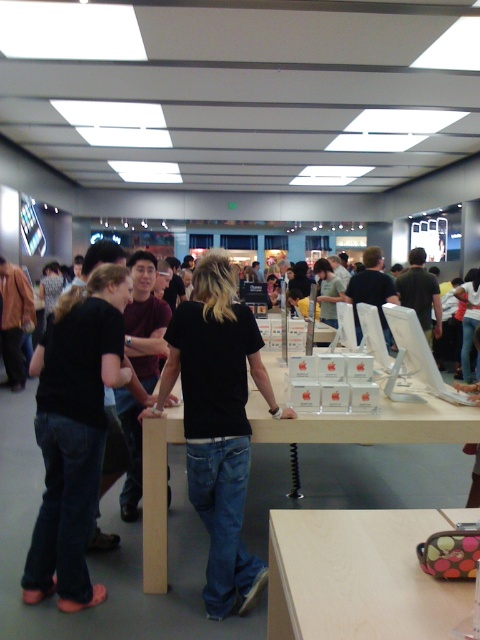
Does wooden table at lower right lie behind light wood table at center?

That is False.

From the picture: Who is more distant from viewer, (374, 522) or (463, 419)?

The point (463, 419) is behind.

At what (x,y) coordinates should I click in order to perform the action: click on wooden table at lower right. Please return your answer as a coordinate pair (x, y). Image resolution: width=480 pixels, height=640 pixels. Looking at the image, I should click on (358, 577).

Find the location of `black matte shirt at center`. black matte shirt at center is located at coordinates coord(217,422).

This screenshot has width=480, height=640. I want to click on black matte shirt at center, so click(x=217, y=422).

Who is shorter, wooden table at lower right or black matte shirt at center?

wooden table at lower right is shorter.

Which is in front, point (325, 524) or point (192, 387)?

Positioned in front is point (325, 524).

Identify the location of wooden table at lower right. (358, 577).